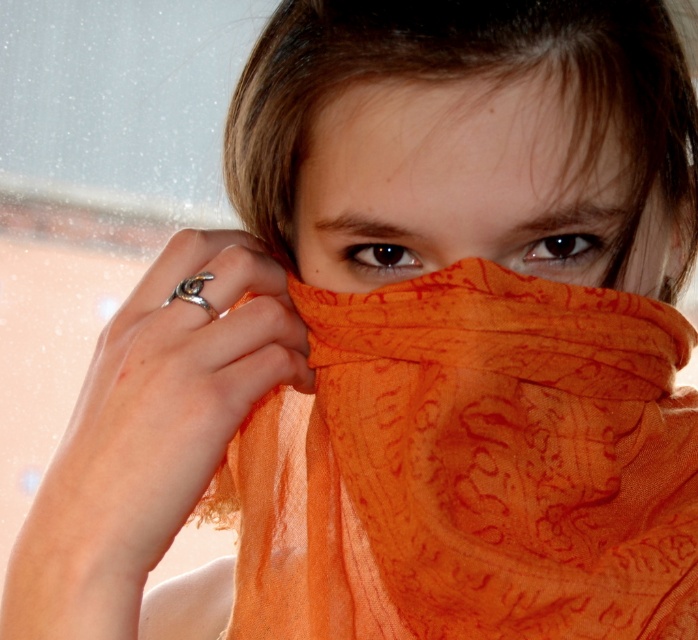
Looking at this image, is orange sheer scarf at center in front of brown matte eye at center?

Yes, orange sheer scarf at center is in front of brown matte eye at center.

The height and width of the screenshot is (640, 698). What do you see at coordinates (470, 467) in the screenshot? I see `orange sheer scarf at center` at bounding box center [470, 467].

Find the location of `orange sheer scarf at center`. orange sheer scarf at center is located at coordinates (470, 467).

Measure the distance between point (660, 465) and camera.

Point (660, 465) and camera are 17.91 inches apart from each other.

Does orange sheer scarf at center have a greater width compared to brownmatteeyes at center?

Yes, orange sheer scarf at center is wider than brownmatteeyes at center.

Where is `orange sheer scarf at center`? orange sheer scarf at center is located at coordinates (470, 467).

Which is below, brown matte eye at upper center or brown matte eye at center?

Positioned lower is brown matte eye at upper center.

How much distance is there between brown matte eye at upper center and brown matte eye at center?

brown matte eye at upper center is 1.77 inches away from brown matte eye at center.

Where is `brown matte eye at upper center`? brown matte eye at upper center is located at coordinates (560, 248).

Find the location of a particular element. brown matte eye at upper center is located at coordinates (560, 248).